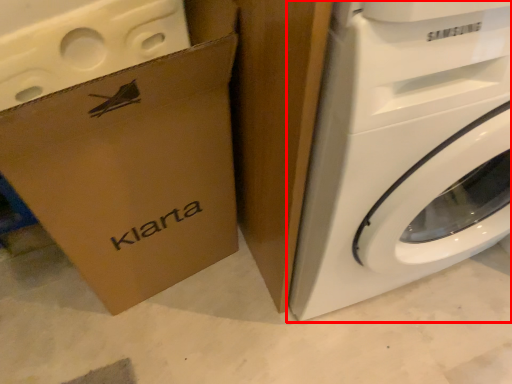
Question: In this image, where is washing machine (annotated by the red box) located relative to cardboard box?

Choices:
 (A) left
 (B) right

Answer: (B)